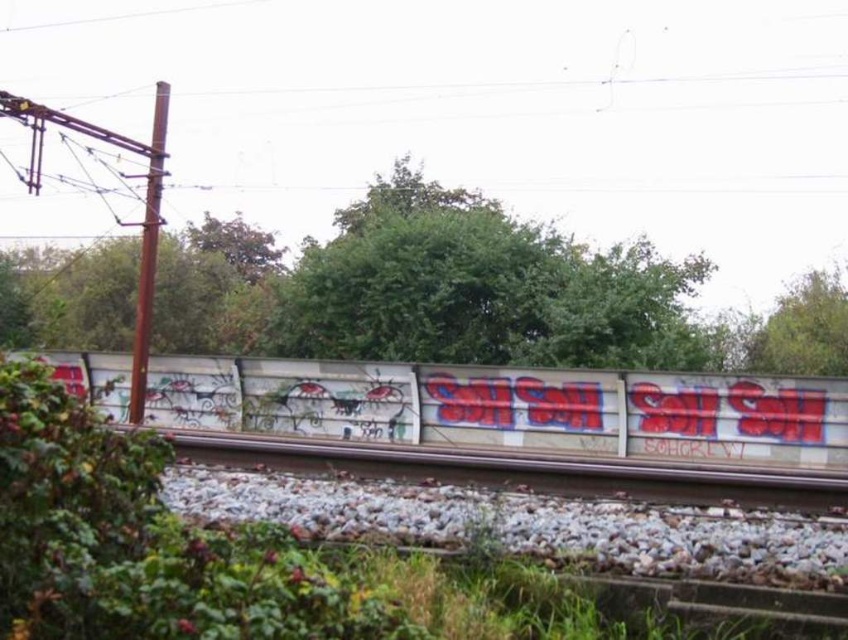
Question: Which object is farther from the camera taking this photo?

Choices:
 (A) white concrete train track at center
 (B) green leafy tree at center
 (C) green leafy tree at upper right

Answer: (C)

Question: Does green leafy tree at center appear over white concrete train track at center?

Choices:
 (A) yes
 (B) no

Answer: (A)

Question: Can you confirm if white concrete train track at center is positioned below green leafy tree at upper right?

Choices:
 (A) no
 (B) yes

Answer: (B)

Question: Which object appears farthest from the camera in this image?

Choices:
 (A) green leafy tree at center
 (B) white graffiti wall at center

Answer: (A)

Question: Among these objects, which one is farthest from the camera?

Choices:
 (A) white concrete train track at center
 (B) green leafy tree at upper right
 (C) green leafy tree at center
 (D) white graffiti wall at center

Answer: (B)

Question: Can you confirm if white concrete train track at center is thinner than green leafy tree at upper right?

Choices:
 (A) no
 (B) yes

Answer: (A)